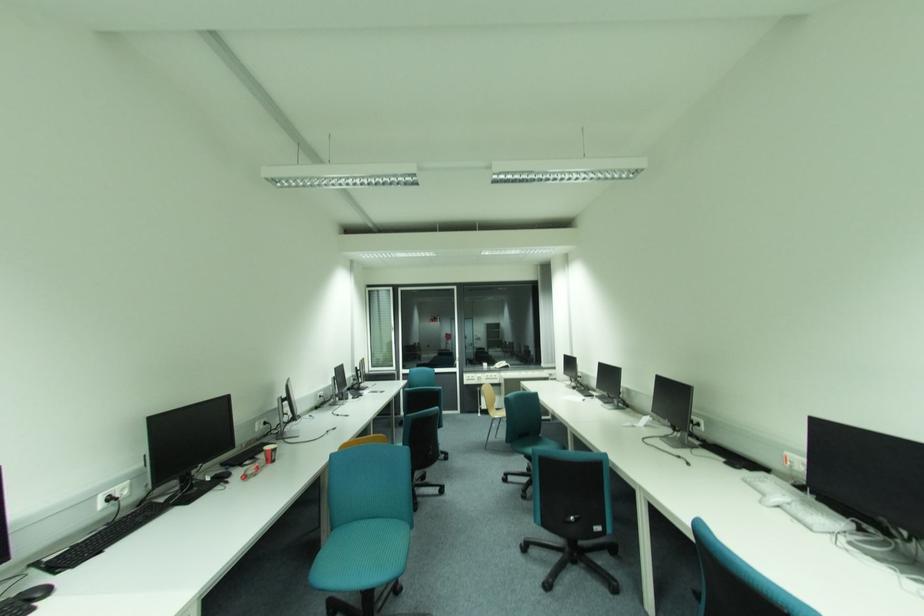
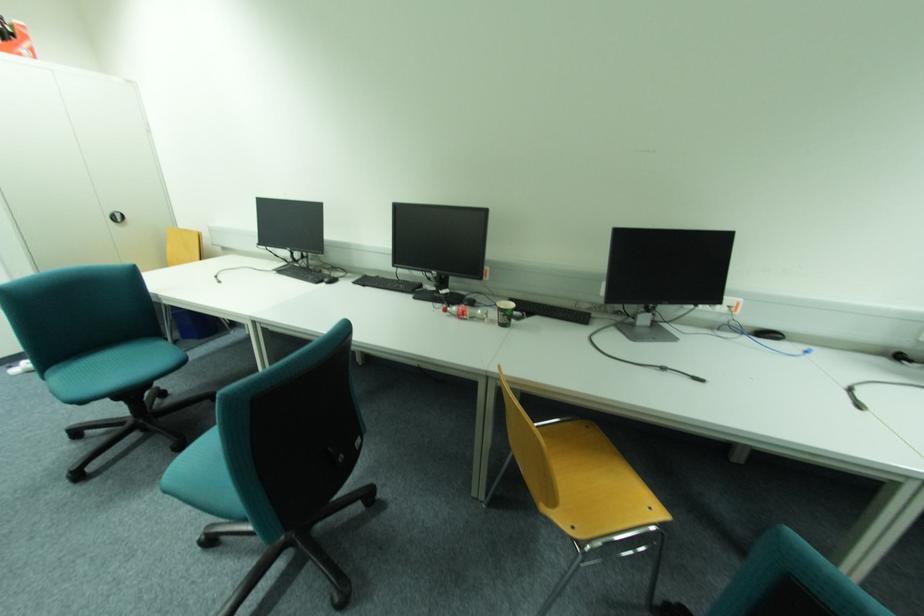
Find the pixel in the second image that matches (x=251, y=477) in the first image.

(451, 310)